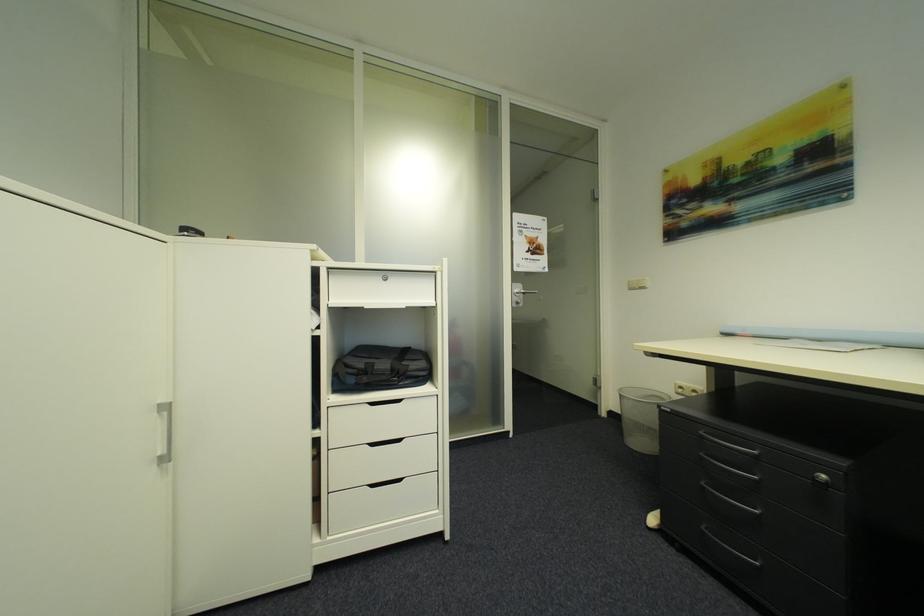
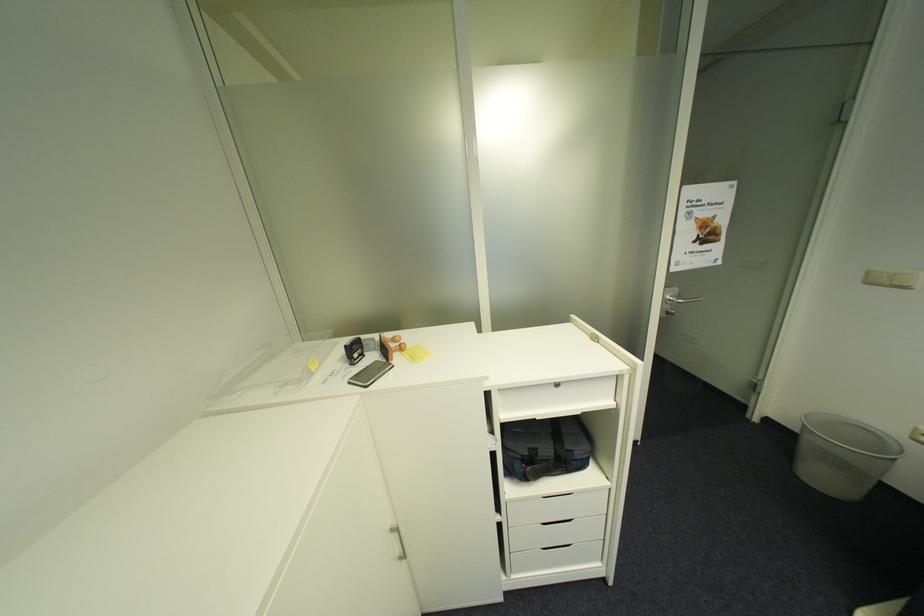
Locate, in the second image, the point that corresponds to (x=525, y=294) in the first image.

(676, 301)